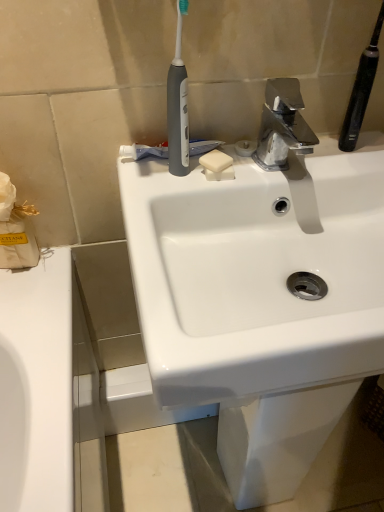
Where is `gray matte toothbrush at upper center, which appears as the first toothbrush when viewed from the left`? gray matte toothbrush at upper center, which appears as the first toothbrush when viewed from the left is located at coordinates pos(178,109).

What is the approximate width of black rubberized toothbrush at upper right, placed as the 2th toothbrush when sorted from left to right?

3.46 centimeters.

Where is `white matte toothpaste at center`? white matte toothpaste at center is located at coordinates (144, 151).

You are a GUI agent. You are given a task and a screenshot of the screen. Output one action in this format:
    pyautogui.click(x=<x>, y=<y>)
    Task: Click on the white matte soap at center
    Image resolution: width=384 pixels, height=512 pixels.
    Given the screenshot: What is the action you would take?
    pyautogui.click(x=216, y=161)

I want to click on polished chrome faucet at upper center, so click(x=282, y=125).

Which object is thinner, black rubberized toothbrush at upper right, placed as the 2th toothbrush when sorted from left to right, or white glossy sink at center?

black rubberized toothbrush at upper right, placed as the 2th toothbrush when sorted from left to right.

Is black rubberized toothbrush at upper right, arranged as the 1th toothbrush when viewed from the right, smaller than white glossy sink at center?

Yes, black rubberized toothbrush at upper right, arranged as the 1th toothbrush when viewed from the right, is smaller than white glossy sink at center.

From the image's perspective, between black rubberized toothbrush at upper right, placed as the 2th toothbrush when sorted from left to right, and white glossy sink at center, who is located below?

white glossy sink at center.

I want to click on sink located below the black rubberized toothbrush at upper right, placed as the 2th toothbrush when sorted from left to right (from the image's perspective), so click(260, 302).

Consider the image. Which is more distant, [200,150] or [12,249]?

The point [12,249] is farther from the camera.

From a real-world perspective, is white matte toothpaste at center on top of white paper tissue at left?

Correct, in the physical world, white matte toothpaste at center is higher than white paper tissue at left.

Considering the sizes of objects white matte toothpaste at center and white paper tissue at left in the image provided, who is taller, white matte toothpaste at center or white paper tissue at left?

With more height is white paper tissue at left.

Which of these two, white matte soap at center or polished chrome faucet at upper center, stands shorter?

white matte soap at center.

In the scene shown: Is polished chrome faucet at upper center at the back of white matte soap at center?

white matte soap at center is not turned away from polished chrome faucet at upper center.

Is white matte soap at center inside or outside of polished chrome faucet at upper center?

white matte soap at center is not enclosed by polished chrome faucet at upper center.

Find the location of a particular element. soap to the left of polished chrome faucet at upper center is located at coordinates (216, 161).

Is white glossy sink at center not within polished chrome faucet at upper center?

Yes, white glossy sink at center is outside of polished chrome faucet at upper center.

Is white glossy sink at center not near polished chrome faucet at upper center?

white glossy sink at center is actually quite close to polished chrome faucet at upper center.

Considering the positions of point (291, 167) and point (306, 125), is point (291, 167) closer or farther from the camera than point (306, 125)?

Point (291, 167) is positioned closer to the camera compared to point (306, 125).

From the image's perspective, is white glossy sink at center above or below polished chrome faucet at upper center?

Clearly, from the image's perspective, white glossy sink at center is below polished chrome faucet at upper center.

Find the location of `soap that is under the black rubberized toothbrush at upper right, arranged as the 1th toothbrush when viewed from the right (from a real-world perspective)`. soap that is under the black rubberized toothbrush at upper right, arranged as the 1th toothbrush when viewed from the right (from a real-world perspective) is located at coordinates (216, 161).

Which of these two, black rubberized toothbrush at upper right, placed as the 2th toothbrush when sorted from left to right, or white matte soap at center, is thinner?

Thinner between the two is black rubberized toothbrush at upper right, placed as the 2th toothbrush when sorted from left to right.

From the image's perspective, relative to white matte soap at center, is black rubberized toothbrush at upper right, placed as the 2th toothbrush when sorted from left to right, above or below?

Based on their image positions, black rubberized toothbrush at upper right, placed as the 2th toothbrush when sorted from left to right, is located above white matte soap at center.

Considering the relative positions of black rubberized toothbrush at upper right, placed as the 2th toothbrush when sorted from left to right, and white matte soap at center in the image provided, is black rubberized toothbrush at upper right, placed as the 2th toothbrush when sorted from left to right, to the left or to the right of white matte soap at center?

Based on their positions, black rubberized toothbrush at upper right, placed as the 2th toothbrush when sorted from left to right, is located to the right of white matte soap at center.

Which is correct: black rubberized toothbrush at upper right, arranged as the 1th toothbrush when viewed from the right, is inside gray matte toothbrush at upper center, which ranks as the second toothbrush in right-to-left order, or outside of it?

black rubberized toothbrush at upper right, arranged as the 1th toothbrush when viewed from the right, lies outside gray matte toothbrush at upper center, which ranks as the second toothbrush in right-to-left order.

Is point (348, 148) behind point (182, 118)?

Yes.

Can you confirm if black rubberized toothbrush at upper right, arranged as the 1th toothbrush when viewed from the right, is positioned to the right of gray matte toothbrush at upper center, which appears as the first toothbrush when viewed from the left?

Yes.

From the image's perspective, is black rubberized toothbrush at upper right, arranged as the 1th toothbrush when viewed from the right, on top of gray matte toothbrush at upper center, which ranks as the second toothbrush in right-to-left order?

Yes, from the image's perspective, black rubberized toothbrush at upper right, arranged as the 1th toothbrush when viewed from the right, is above gray matte toothbrush at upper center, which ranks as the second toothbrush in right-to-left order.

Is the depth of white paper tissue at left greater than that of polished chrome faucet at upper center?

Yes, the depth of white paper tissue at left is greater than that of polished chrome faucet at upper center.

Is white paper tissue at left at the right side of polished chrome faucet at upper center?

Incorrect, white paper tissue at left is not on the right side of polished chrome faucet at upper center.

Can you confirm if white paper tissue at left is smaller than polished chrome faucet at upper center?

No.

Identify the location of the 1st toothbrush directly above the white glossy sink at center (from a real-world perspective). The width and height of the screenshot is (384, 512). (361, 90).

Locate an element on the screen. tissue on the left of white matte toothpaste at center is located at coordinates (15, 229).

Considering their positions, is polished chrome faucet at upper center positioned closer to black rubberized toothbrush at upper right, placed as the 2th toothbrush when sorted from left to right, than gray matte toothbrush at upper center, which ranks as the second toothbrush in right-to-left order?

Among the two, polished chrome faucet at upper center is located nearer to black rubberized toothbrush at upper right, placed as the 2th toothbrush when sorted from left to right.

Based on their spatial positions, is gray matte toothbrush at upper center, which appears as the first toothbrush when viewed from the left, or black rubberized toothbrush at upper right, placed as the 2th toothbrush when sorted from left to right, further from white matte toothpaste at center?

Based on the image, black rubberized toothbrush at upper right, placed as the 2th toothbrush when sorted from left to right, appears to be further to white matte toothpaste at center.

Considering their positions, is white paper tissue at left positioned closer to black rubberized toothbrush at upper right, placed as the 2th toothbrush when sorted from left to right, than polished chrome faucet at upper center?

Among the two, polished chrome faucet at upper center is located nearer to black rubberized toothbrush at upper right, placed as the 2th toothbrush when sorted from left to right.

Considering their positions, is white matte toothpaste at center positioned further to gray matte toothbrush at upper center, which appears as the first toothbrush when viewed from the left, than white glossy sink at center?

white glossy sink at center lies further to gray matte toothbrush at upper center, which appears as the first toothbrush when viewed from the left, than the other object.

Based on their spatial positions, is polished chrome faucet at upper center or white matte toothpaste at center further from gray matte toothbrush at upper center, which appears as the first toothbrush when viewed from the left?

Among the two, polished chrome faucet at upper center is located further to gray matte toothbrush at upper center, which appears as the first toothbrush when viewed from the left.

When comparing their distances from white paper tissue at left, does polished chrome faucet at upper center or white matte soap at center seem further?

polished chrome faucet at upper center is positioned further to the anchor white paper tissue at left.

Consider the image. When comparing their distances from black rubberized toothbrush at upper right, placed as the 2th toothbrush when sorted from left to right, does white paper tissue at left or white matte soap at center seem closer?

white matte soap at center.

Considering their positions, is white paper tissue at left positioned further to white matte toothpaste at center than gray matte toothbrush at upper center, which ranks as the second toothbrush in right-to-left order?

white paper tissue at left lies further to white matte toothpaste at center than the other object.

Locate an element on the screen. The width and height of the screenshot is (384, 512). soap between gray matte toothbrush at upper center, which ranks as the second toothbrush in right-to-left order, and white matte toothpaste at center from front to back is located at coordinates (216, 161).

Locate an element on the screen. The image size is (384, 512). tap between white matte soap at center and black rubberized toothbrush at upper right, placed as the 2th toothbrush when sorted from left to right, in the horizontal direction is located at coordinates (282, 125).

Find the location of `toothbrush between white paper tissue at left and black rubberized toothbrush at upper right, arranged as the 1th toothbrush when viewed from the right, in the horizontal direction`. toothbrush between white paper tissue at left and black rubberized toothbrush at upper right, arranged as the 1th toothbrush when viewed from the right, in the horizontal direction is located at coordinates (178, 109).

Where is `toothpaste between white paper tissue at left and black rubberized toothbrush at upper right, placed as the 2th toothbrush when sorted from left to right`? This screenshot has width=384, height=512. toothpaste between white paper tissue at left and black rubberized toothbrush at upper right, placed as the 2th toothbrush when sorted from left to right is located at coordinates (144, 151).